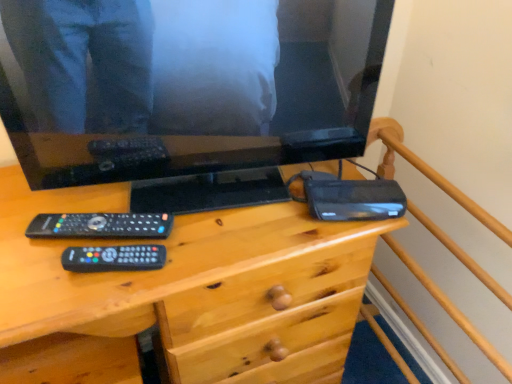
Question: From the image's perspective, relative to wooden desk at center, is black glossy television at upper center above or below?

Choices:
 (A) below
 (B) above

Answer: (B)

Question: From their relative heights in the image, would you say black glossy television at upper center is taller or shorter than wooden desk at center?

Choices:
 (A) short
 (B) tall

Answer: (A)

Question: Based on their relative distances, which object is farther from the black matte router at right?

Choices:
 (A) black glossy television at upper center
 (B) wooden bed frame at upper right
 (C) wooden desk at center

Answer: (C)

Question: Which is nearer to the wooden desk at center?

Choices:
 (A) black glossy television at upper center
 (B) black matte router at right
 (C) wooden bed frame at upper right

Answer: (A)